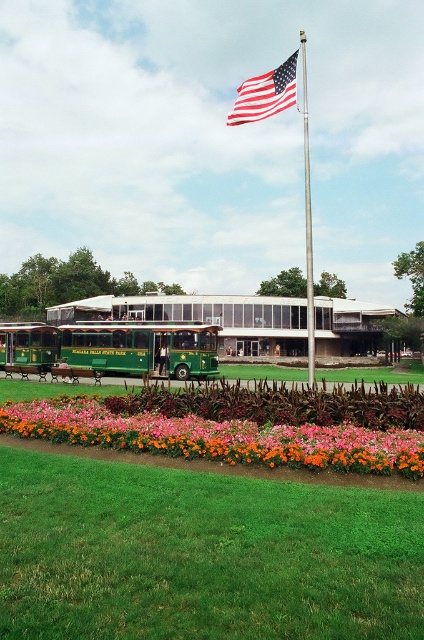
You are a tour guide leading a group to the flag pole. You see the green polished wood trolley at left and the polished metal flag pole at center. How far apart are these two landmarks?

The green polished wood trolley at left and the polished metal flag pole at center are 24.33 meters apart.

You are standing at the camera position and want to take a photo of the green polished wood trolley at center. The recommended distance for clear photos is 100 feet. Is the trolley within the recommended distance?

The green polished wood trolley at center is 105.27 feet from camera, which is slightly beyond the recommended 100 feet distance for clear photos. To get a clearer photo, you might need to move closer or use a zoom lens.

You are a tour guide planning to take a group photo of your visitors. You want to position them between the green polished wood trolley at center and the american flag at upper center so that both objects are visible in the background. Given that the recommended distance for a group photo is 3 meters, will this be possible?

The distance between the green polished wood trolley at center and the american flag at upper center is 21.03 meters. Since the recommended distance for a group photo is 3 meters, positioning the group between them would require them to be much closer than 21.03 meters, so it is possible to take the photo with both objects visible in the background.